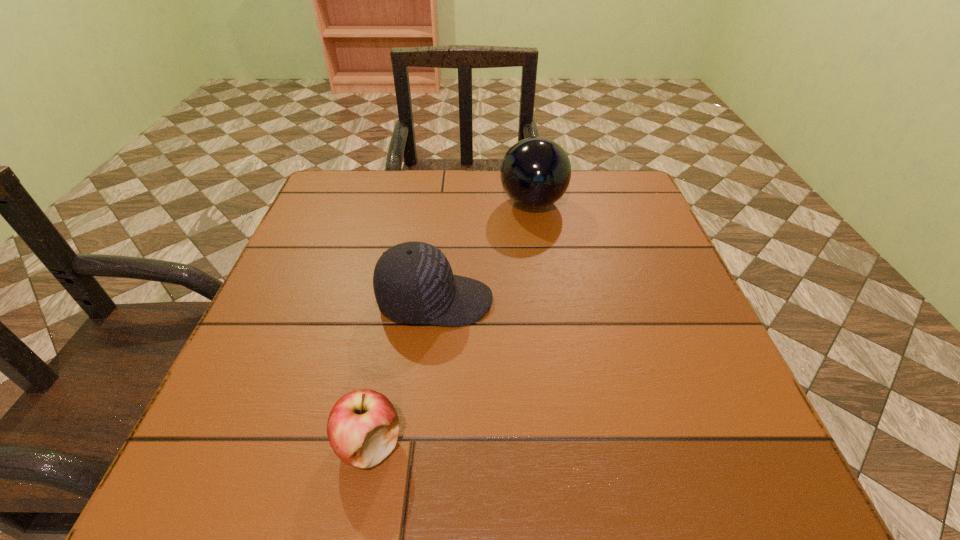
You are a GUI agent. You are given a task and a screenshot of the screen. Output one action in this format:
    pyautogui.click(x=<x>, y=<y>)
    Task: Click on the rightmost object
    The height and width of the screenshot is (540, 960).
    Given the screenshot: What is the action you would take?
    pyautogui.click(x=535, y=173)

Locate an element on the screen. the tallest object is located at coordinates (535, 173).

Locate an element on the screen. This screenshot has height=540, width=960. the second farthest object is located at coordinates (413, 282).

At what (x,y) coordinates should I click in order to perform the action: click on the second tallest object. Please return your answer as a coordinate pair (x, y). This screenshot has width=960, height=540. Looking at the image, I should click on (413, 282).

Where is `apple`? This screenshot has width=960, height=540. apple is located at coordinates (363, 426).

Where is `the nearest object`? The image size is (960, 540). the nearest object is located at coordinates (363, 426).

I want to click on free space located 0.070m on the side of the rightmost object with the finger holes, so click(x=472, y=203).

Where is `vacant space located 0.280m on the side of the rightmost object with the finger holes`? vacant space located 0.280m on the side of the rightmost object with the finger holes is located at coordinates (389, 203).

You are a GUI agent. You are given a task and a screenshot of the screen. Output one action in this format:
    pyautogui.click(x=<x>, y=<y>)
    Task: Click on the vacant space located on the side of the rightmost object with the finger holes
    The height and width of the screenshot is (540, 960).
    Given the screenshot: What is the action you would take?
    pyautogui.click(x=456, y=203)

This screenshot has height=540, width=960. I want to click on vacant point located 0.170m at the front of the second shortest object where the brim is located, so click(x=579, y=301).